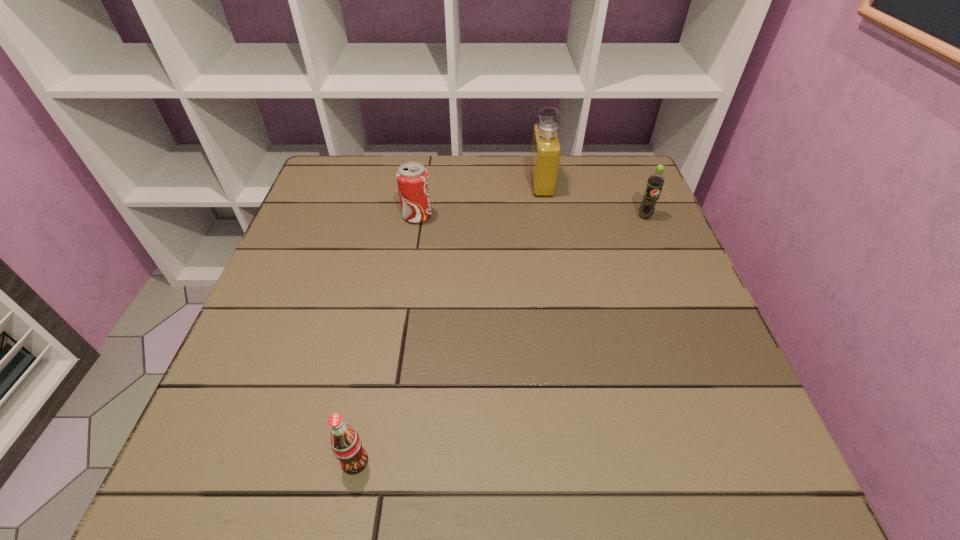
You are a GUI agent. You are given a task and a screenshot of the screen. Output one action in this format:
    pyautogui.click(x=<x>, y=<y>)
    Task: Click on the farthest object
    This screenshot has height=540, width=960.
    Given the screenshot: What is the action you would take?
    (546, 149)

This screenshot has height=540, width=960. In order to click on the tallest object in this screenshot , I will do `click(546, 149)`.

The image size is (960, 540). What are the coordinates of `the rightmost object` in the screenshot? It's located at (655, 182).

Find the location of a particular element. The width and height of the screenshot is (960, 540). the nearest soda is located at coordinates (346, 444).

This screenshot has width=960, height=540. In order to click on vacant space located 0.290m on the front-facing side of the third object from left to right in this screenshot , I will do `click(424, 184)`.

This screenshot has width=960, height=540. I want to click on vacant area situated 0.120m on the front-facing side of the third object from left to right, so click(487, 184).

The image size is (960, 540). Find the location of `free spot located 0.330m on the front-facing side of the third object from left to right`. free spot located 0.330m on the front-facing side of the third object from left to right is located at coordinates (410, 184).

You are a GUI agent. You are given a task and a screenshot of the screen. Output one action in this format:
    pyautogui.click(x=<x>, y=<y>)
    Task: Click on the vacant space located on the front label of the rightmost object
    
    Given the screenshot: What is the action you would take?
    pyautogui.click(x=671, y=280)

This screenshot has width=960, height=540. Find the location of `free space located on the back of the nearest object`. free space located on the back of the nearest object is located at coordinates click(390, 282).

In order to click on object that is at the far edge in this screenshot , I will do `click(546, 149)`.